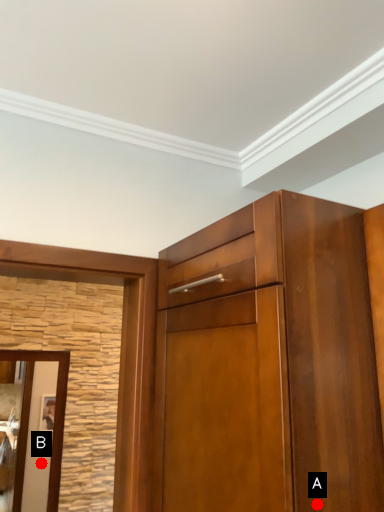
Question: Two points are circled on the image, labeled by A and B beside each circle. Which of the following is the farthest from the observer?

Choices:
 (A) A is further
 (B) B is further

Answer: (B)